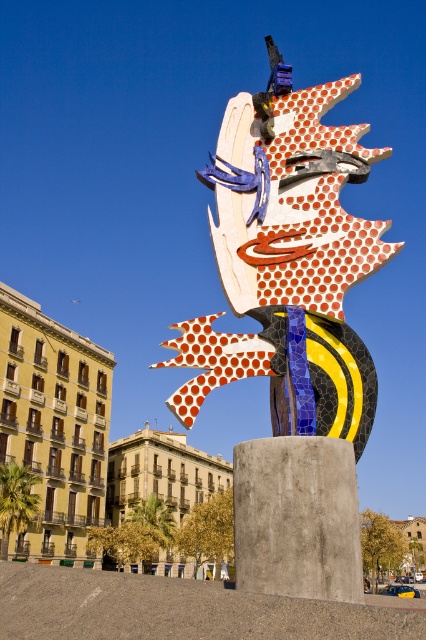
Question: Does polka dot mosaic face at center lie in front of polychrome mosaic sculpture at center?

Choices:
 (A) no
 (B) yes

Answer: (A)

Question: Which object appears closest to the camera in this image?

Choices:
 (A) polka dot mosaic face at center
 (B) polychrome mosaic sculpture at center

Answer: (B)

Question: Can you confirm if polka dot mosaic face at center is positioned above polychrome mosaic sculpture at center?

Choices:
 (A) yes
 (B) no

Answer: (A)

Question: Which point is farther from the camera taking this photo?

Choices:
 (A) click(359, 380)
 (B) click(247, 602)

Answer: (A)

Question: Is polka dot mosaic face at center thinner than polychrome mosaic sculpture at center?

Choices:
 (A) yes
 (B) no

Answer: (A)